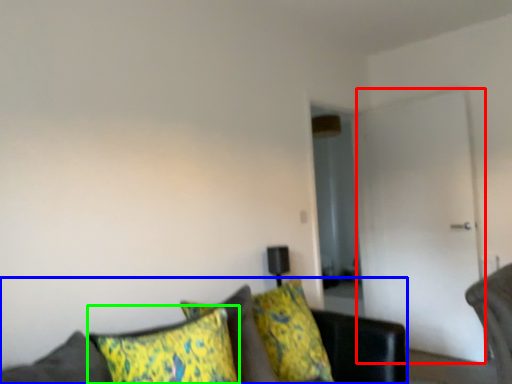
Question: Considering the real-world distances, which object is closest to glass door (highlighted by a red box)? studio couch (highlighted by a blue box) or pillow (highlighted by a green box).

Choices:
 (A) studio couch
 (B) pillow

Answer: (A)